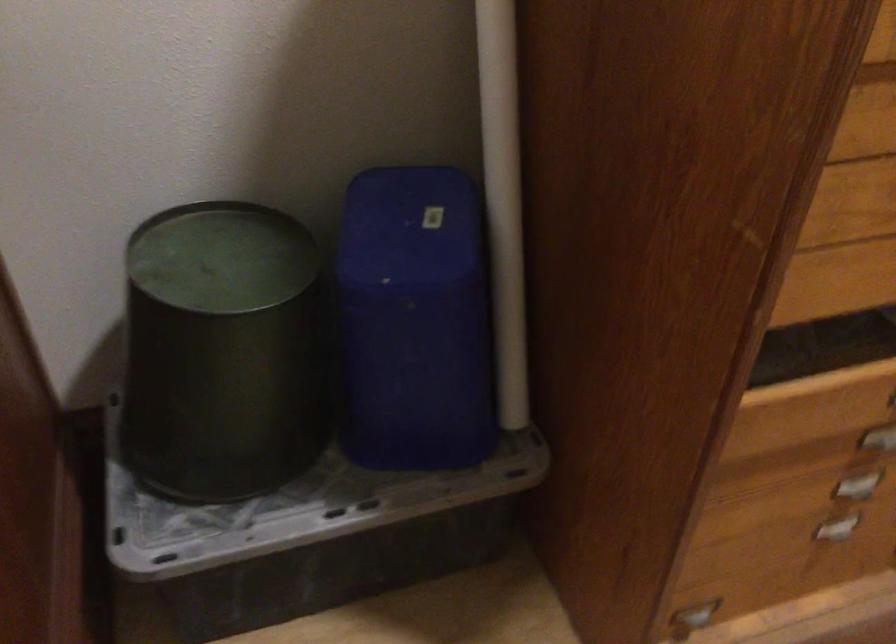
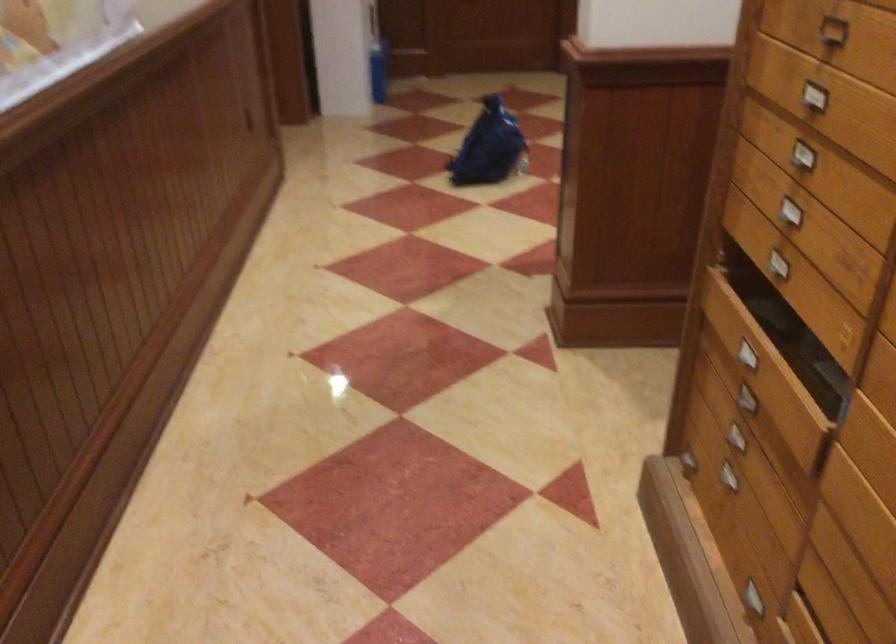
Question: I am providing you with two images of the same scene from different viewpoints. After the viewpoint changes to image2, which objects are now occluded?

Choices:
 (A) orange whiteboard magnet
 (B) blue plastic bin
 (C) blue plastic bag
 (D) metal drawer handle

Answer: (B)